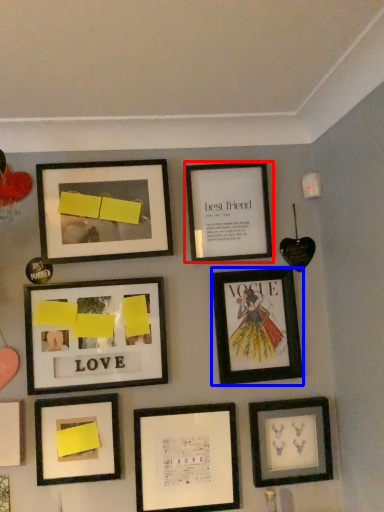
Question: Which object appears farthest to the camera in this image, picture frame (highlighted by a red box) or picture frame (highlighted by a blue box)?

Choices:
 (A) picture frame
 (B) picture frame

Answer: (A)